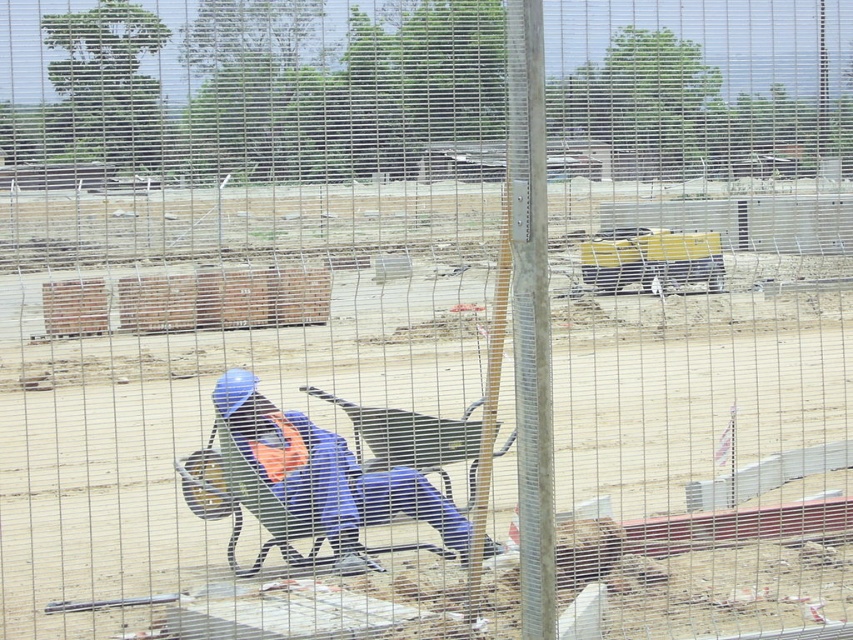
Question: Does blue hard hat at center appear on the right side of orange fabric safety vest at center?

Choices:
 (A) yes
 (B) no

Answer: (A)

Question: Which of the following is the closest to the observer?

Choices:
 (A) (281, 458)
 (B) (258, 556)

Answer: (B)

Question: Does blue hard hat at center lie in front of orange fabric safety vest at center?

Choices:
 (A) no
 (B) yes

Answer: (B)

Question: Is blue hard hat at center bigger than orange fabric safety vest at center?

Choices:
 (A) yes
 (B) no

Answer: (A)

Question: Which of the following is the closest to the observer?

Choices:
 (A) orange fabric safety vest at center
 (B) blue hard hat at center

Answer: (B)